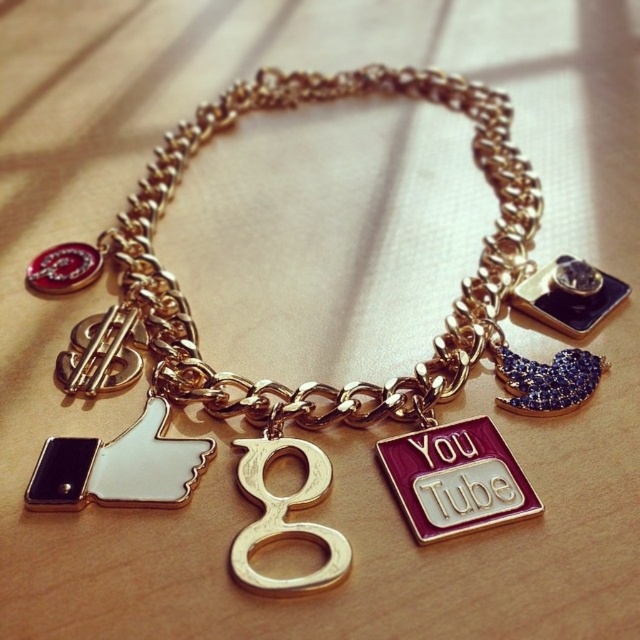
Find the location of a particular element. The height and width of the screenshot is (640, 640). white matte thumbs up at center is located at coordinates (120, 467).

Between white matte thumbs up at center and gold metallic letter "g" at center, which one appears on the left side from the viewer's perspective?

Positioned to the left is white matte thumbs up at center.

Is point (106, 502) in front of point (305, 444)?

Yes, point (106, 502) is in front of point (305, 444).

At what (x,y) coordinates should I click in order to perform the action: click on white matte thumbs up at center. Please return your answer as a coordinate pair (x, y). The image size is (640, 640). Looking at the image, I should click on (120, 467).